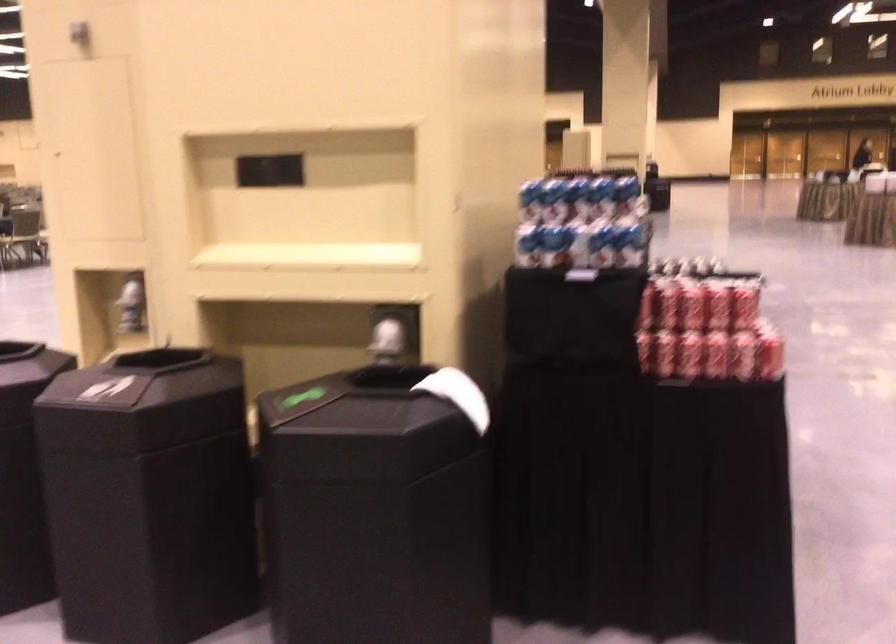
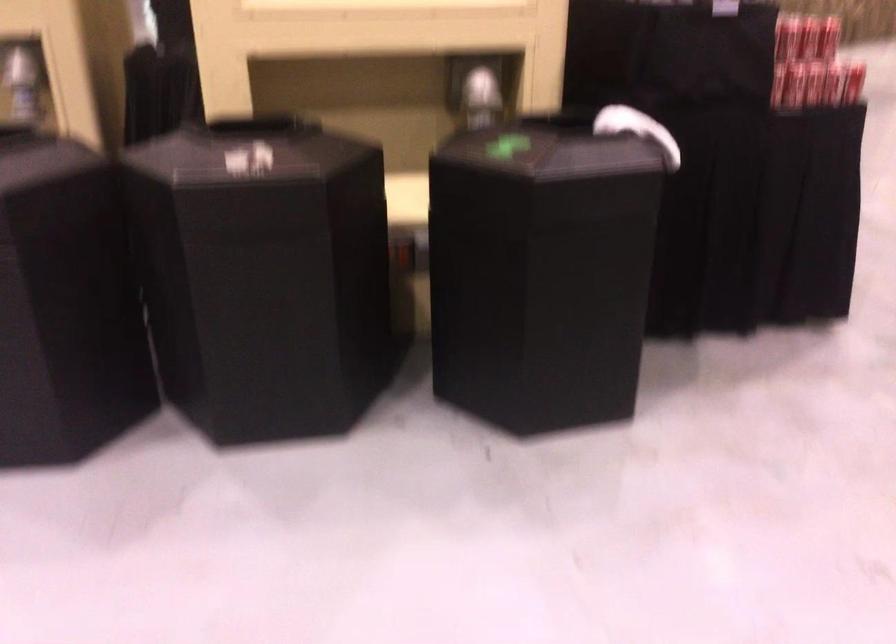
Locate, in the second image, the point that corresponds to point 677,308 in the first image.

(787, 37)